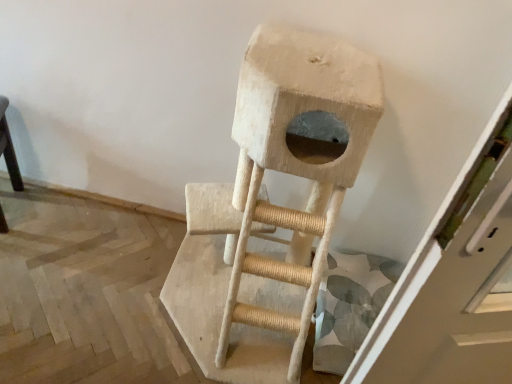
Image resolution: width=512 pixels, height=384 pixels. I want to click on free region under natural wood cat tree at center (from a real-world perspective), so click(213, 305).